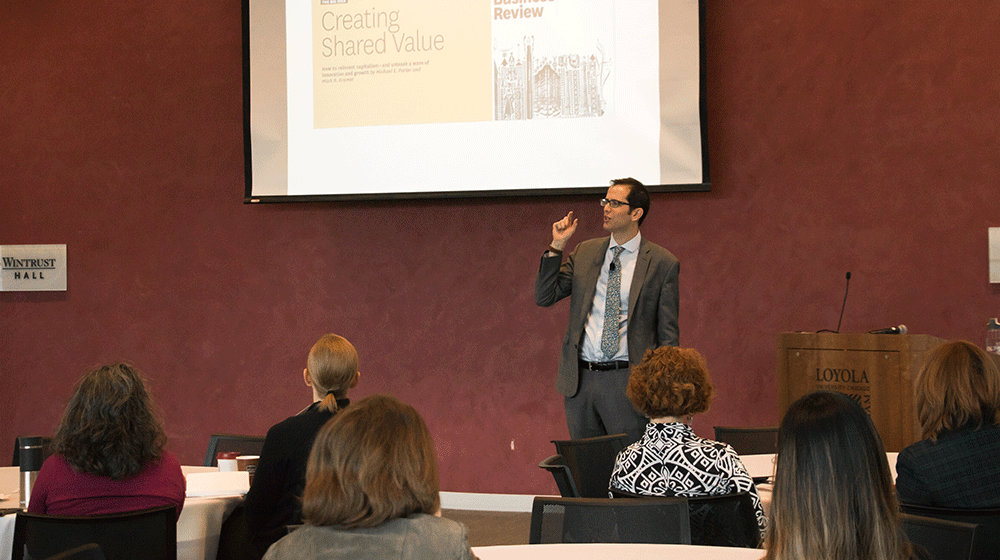
Find the location of a particular element. The width and height of the screenshot is (1000, 560). projector screen is located at coordinates (492, 132).